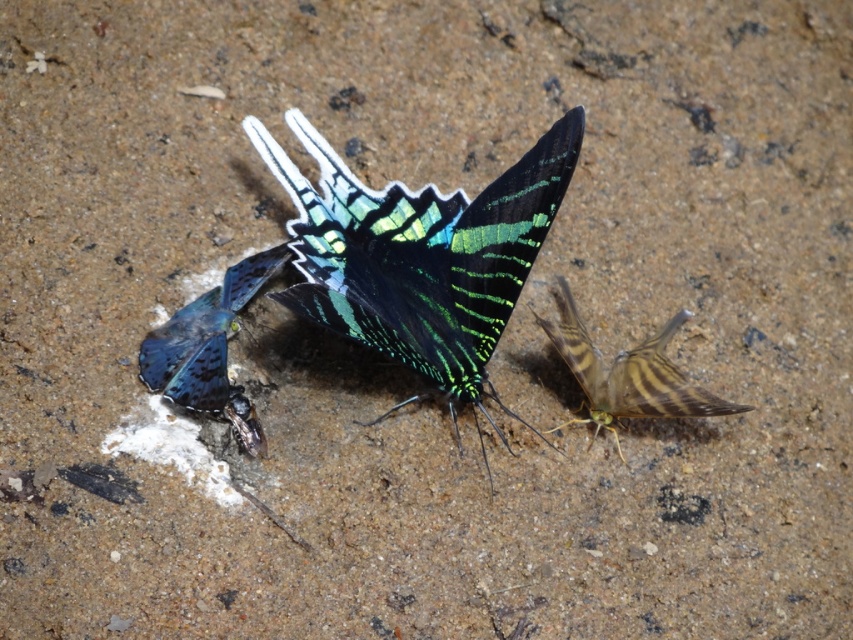
Question: Which is nearer to the shiny blue butterfly at left?

Choices:
 (A) shiny metallic insect at center
 (B) shiny metallic butterfly at center

Answer: (A)

Question: Among these points, which one is nearest to the camera?

Choices:
 (A) (166, 376)
 (B) (248, 426)
 (C) (380, 193)
 (D) (605, 376)

Answer: (A)

Question: Considering the relative positions of shiny metallic butterfly at center and shiny blue butterfly at left in the image provided, where is shiny metallic butterfly at center located with respect to shiny blue butterfly at left?

Choices:
 (A) below
 (B) above

Answer: (B)

Question: Does shiny blue butterfly at left have a lesser width compared to shiny metallic insect at center?

Choices:
 (A) yes
 (B) no

Answer: (B)

Question: Is brown striped butterfly at right smaller than shiny metallic insect at center?

Choices:
 (A) no
 (B) yes

Answer: (A)

Question: Which object is positioned farthest from the brown striped butterfly at right?

Choices:
 (A) shiny metallic butterfly at center
 (B) shiny metallic insect at center
 (C) shiny blue butterfly at left

Answer: (B)